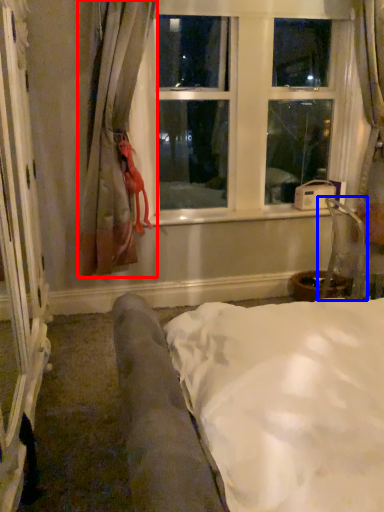
Question: Which object is further to the camera taking this photo, curtain (highlighted by a red box) or armchair (highlighted by a blue box)?

Choices:
 (A) curtain
 (B) armchair

Answer: (B)